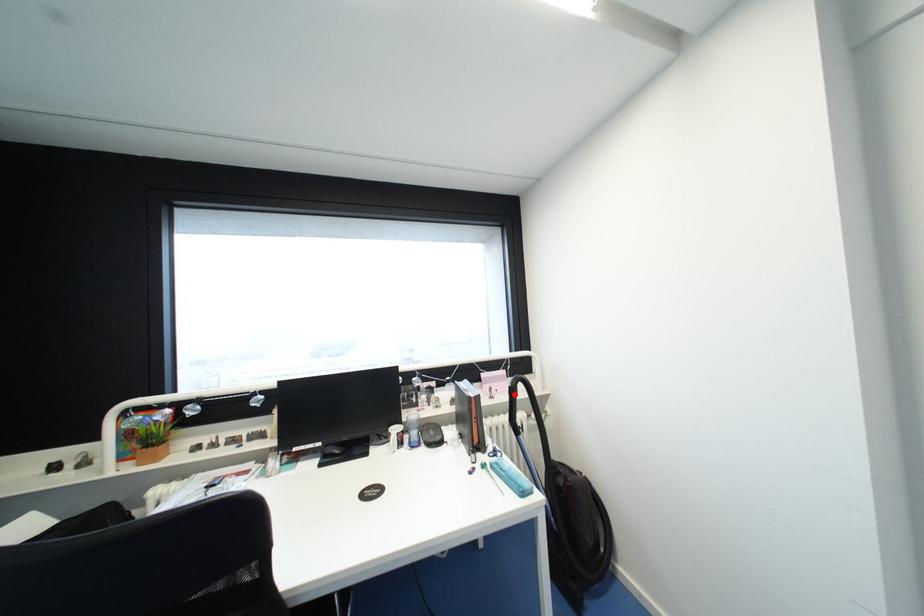
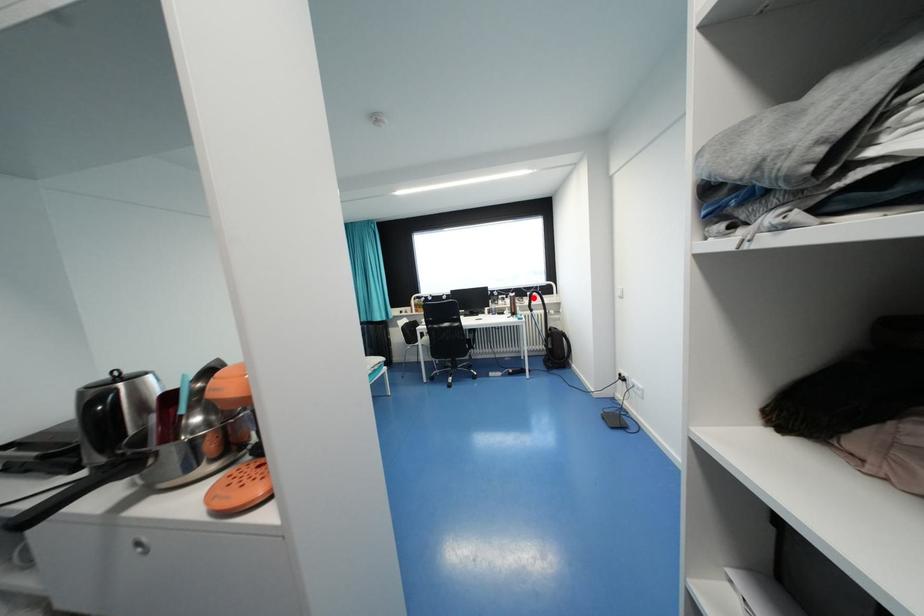
I am providing you with two images of the same scene from different viewpoints. A red point is marked on the first image and another point is marked on the second image. Does the point marked in image1 correspond to the same location as the one in image2?

Yes